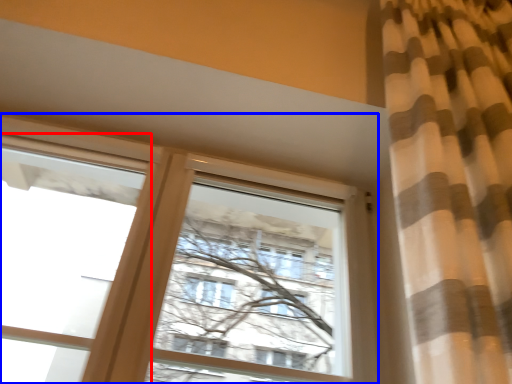
Question: Which point is further to the camera, window (highlighted by a red box) or window (highlighted by a blue box)?

Choices:
 (A) window
 (B) window

Answer: (B)